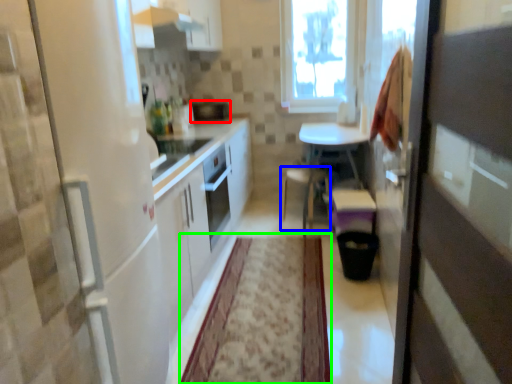
Question: Estimate the real-world distances between objects in this image. Which object is closer to appliance (highlighted by a red box), chair (highlighted by a blue box) or plain (highlighted by a green box)?

Choices:
 (A) chair
 (B) plain

Answer: (A)